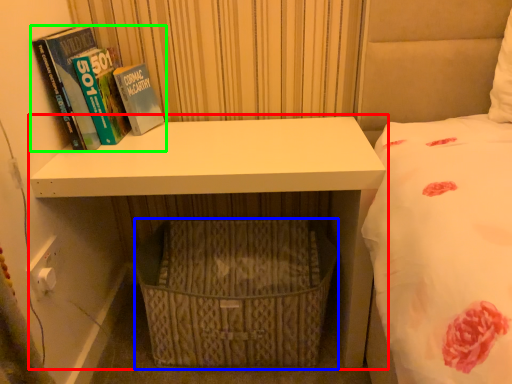
Question: Which is farther away from shelf (highlighted by a red box)? basket (highlighted by a blue box) or book (highlighted by a green box)?

Choices:
 (A) basket
 (B) book

Answer: (B)